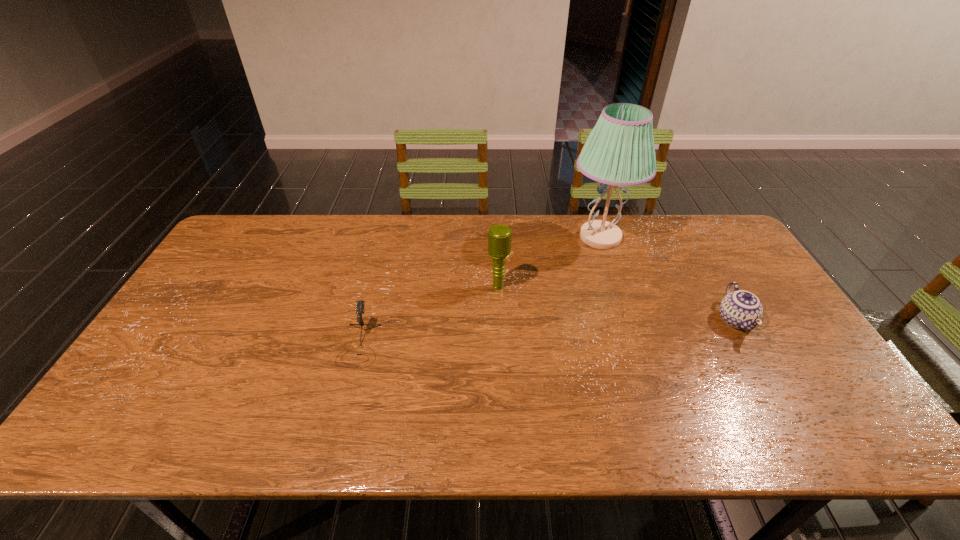
At what (x,y) coordinates should I click in order to perform the action: click on the second object from right to left. Please return your answer as a coordinate pair (x, y). Image resolution: width=960 pixels, height=540 pixels. Looking at the image, I should click on (619, 151).

Identify the location of the farthest object. (619, 151).

This screenshot has width=960, height=540. In order to click on the right microphone in this screenshot , I will do `click(499, 236)`.

The image size is (960, 540). I want to click on the second object from left to right, so click(x=499, y=236).

I want to click on chinaware, so click(741, 309).

This screenshot has width=960, height=540. What are the coordinates of `the shorter microphone` in the screenshot? It's located at (360, 303).

Find the location of a particular element. The width and height of the screenshot is (960, 540). the leftmost object is located at coordinates (360, 303).

Find the location of a particular element. vacant point located on the front of the tallest object is located at coordinates (625, 310).

You are a GUI agent. You are given a task and a screenshot of the screen. Output one action in this format:
    pyautogui.click(x=<x>, y=<y>)
    Task: Click on the vacant position located on the front of the third object from right to left
    
    Given the screenshot: What is the action you would take?
    pyautogui.click(x=502, y=387)

This screenshot has height=540, width=960. Find the location of `vacant space located 0.190m at the spout of the rightmost object`. vacant space located 0.190m at the spout of the rightmost object is located at coordinates (785, 407).